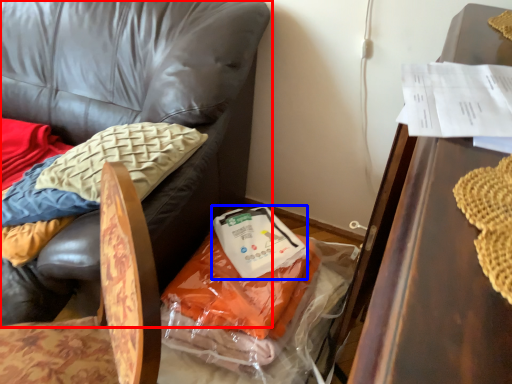
Question: Which point is further to the camera, chair (highlighted by a red box) or food (highlighted by a blue box)?

Choices:
 (A) chair
 (B) food

Answer: (B)